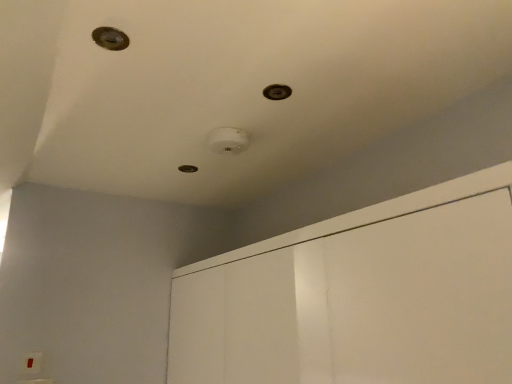
Question: From a real-world perspective, is metallic circular hole at upper left, the first hole from the front, on top of metallic circular hole at center, which is the third hole in front-to-back order?

Choices:
 (A) yes
 (B) no

Answer: (B)

Question: From the image's perspective, is metallic circular hole at upper left, the first hole from the front, beneath metallic circular hole at center, the first hole ordered from the bottom?

Choices:
 (A) yes
 (B) no

Answer: (B)

Question: From a real-world perspective, is metallic circular hole at upper left, marked as the 3th hole in a right-to-left arrangement, beneath metallic circular hole at center, the 2th hole positioned from the right?

Choices:
 (A) no
 (B) yes

Answer: (B)

Question: Considering the relative sizes of metallic circular hole at upper left, which is the third hole in back-to-front order, and metallic circular hole at center, the first hole ordered from the bottom, in the image provided, is metallic circular hole at upper left, which is the third hole in back-to-front order, smaller than metallic circular hole at center, the first hole ordered from the bottom,?

Choices:
 (A) yes
 (B) no

Answer: (A)

Question: From the image's perspective, is metallic circular hole at upper left, the first hole in the left-to-right sequence, over metallic circular hole at center, the first hole ordered from the bottom?

Choices:
 (A) no
 (B) yes

Answer: (B)

Question: Does metallic circular hole at upper left, the first hole in the left-to-right sequence, appear on the right side of metallic circular hole at center, which is the third hole in front-to-back order?

Choices:
 (A) no
 (B) yes

Answer: (A)

Question: From the image's perspective, does white glossy dresser at upper center appear higher than metallic circular hole at center, the 2th hole positioned from the right?

Choices:
 (A) no
 (B) yes

Answer: (A)

Question: Could you tell me if white glossy dresser at upper center is facing metallic circular hole at center, the 2th hole positioned from the right?

Choices:
 (A) yes
 (B) no

Answer: (B)

Question: Does white glossy dresser at upper center have a lesser height compared to metallic circular hole at center, the third hole from the top?

Choices:
 (A) no
 (B) yes

Answer: (A)

Question: Considering the relative sizes of white glossy dresser at upper center and metallic circular hole at center, the 2th hole positioned from the right, in the image provided, is white glossy dresser at upper center bigger than metallic circular hole at center, the 2th hole positioned from the right,?

Choices:
 (A) no
 (B) yes

Answer: (B)

Question: Is white glossy dresser at upper center smaller than metallic circular hole at center, which ranks as the 2th hole in left-to-right order?

Choices:
 (A) yes
 (B) no

Answer: (B)

Question: From the image's perspective, is white glossy dresser at upper center under metallic circular hole at center, which is the third hole in front-to-back order?

Choices:
 (A) no
 (B) yes

Answer: (B)

Question: Does metallic circular hole at center, which is the third hole in front-to-back order, appear on the right side of white glossy dresser at upper center?

Choices:
 (A) yes
 (B) no

Answer: (B)